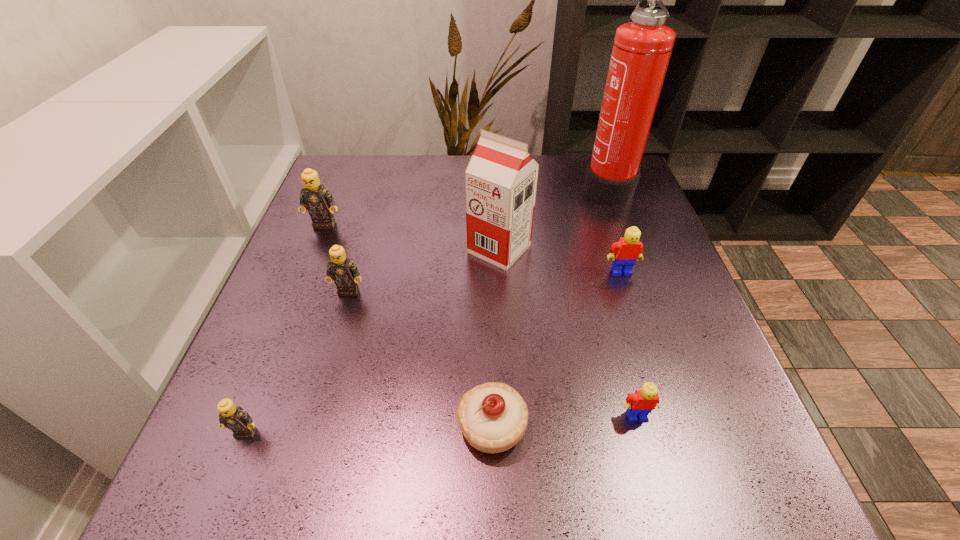
Find the location of `vacant space located 0.300m in front of the third object from left to right`. vacant space located 0.300m in front of the third object from left to right is located at coordinates (306, 437).

Identify the location of free region located 0.130m on the front-facing side of the fourth farthest Lego. The width and height of the screenshot is (960, 540). (661, 509).

At what (x,y) coordinates should I click in order to perform the action: click on free space located 0.060m in front of the nearest Lego. Please return your answer as a coordinate pair (x, y). Looking at the image, I should click on click(x=228, y=478).

Where is `vacant space situated on the left of the pastry`? Image resolution: width=960 pixels, height=540 pixels. vacant space situated on the left of the pastry is located at coordinates (401, 426).

Where is `object that is at the far edge`? The width and height of the screenshot is (960, 540). object that is at the far edge is located at coordinates (641, 51).

Image resolution: width=960 pixels, height=540 pixels. In order to click on object that is positioned at the near edge in this screenshot , I will do `click(493, 417)`.

Identify the location of fire extinguisher that is at the right edge. Image resolution: width=960 pixels, height=540 pixels. [641, 51].

Identify the location of object that is at the far right corner. The height and width of the screenshot is (540, 960). (641, 51).

Find the location of a particular element. vacant region at the far edge is located at coordinates (574, 186).

Image resolution: width=960 pixels, height=540 pixels. In order to click on free space at the near edge of the desktop in this screenshot , I will do `click(431, 478)`.